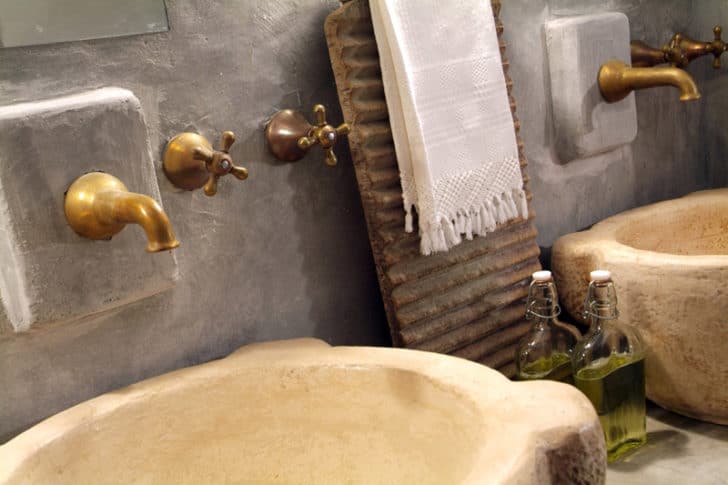
I want to click on faucet valve, so click(325, 134), click(213, 161), click(678, 52), click(718, 51).